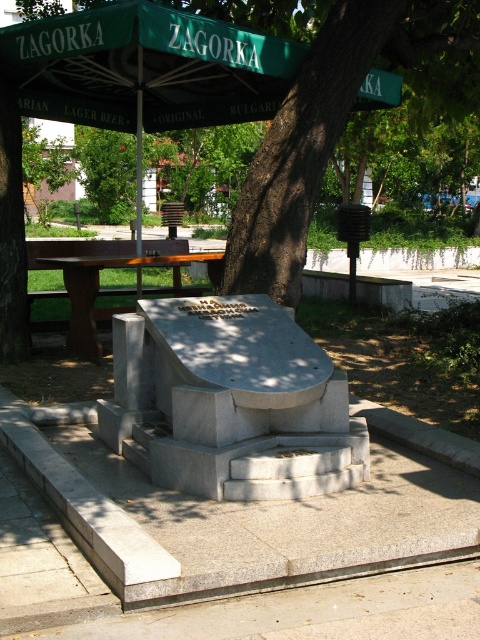
Can you confirm if gray granite monument at center is taller than brown wooden picnic table at left?

No, gray granite monument at center is not taller than brown wooden picnic table at left.

Who is shorter, gray granite monument at center or brown wooden picnic table at left?

With less height is gray granite monument at center.

Which is behind, point (276, 529) or point (116, 294)?

The point (116, 294) is more distant.

Locate an element on the screen. Image resolution: width=480 pixels, height=640 pixels. gray granite monument at center is located at coordinates (244, 516).

Who is positioned more to the right, gray granite monument at center or green leafy tree at center?

From the viewer's perspective, green leafy tree at center appears more on the right side.

Does gray granite monument at center have a lesser width compared to green leafy tree at center?

Incorrect, gray granite monument at center's width is not less than green leafy tree at center's.

What do you see at coordinates (244, 516) in the screenshot?
I see `gray granite monument at center` at bounding box center [244, 516].

Where is `gray granite monument at center`? This screenshot has width=480, height=640. gray granite monument at center is located at coordinates (244, 516).

Between point (90, 67) and point (72, 332), which one is positioned in front?

Point (90, 67)

Can you confirm if green fabric umbrella at upper center is shorter than brown wooden picnic table at left?

Yes, green fabric umbrella at upper center is shorter than brown wooden picnic table at left.

What do you see at coordinates (146, 67) in the screenshot? I see `green fabric umbrella at upper center` at bounding box center [146, 67].

Locate an element on the screen. This screenshot has height=640, width=480. green fabric umbrella at upper center is located at coordinates (146, 67).